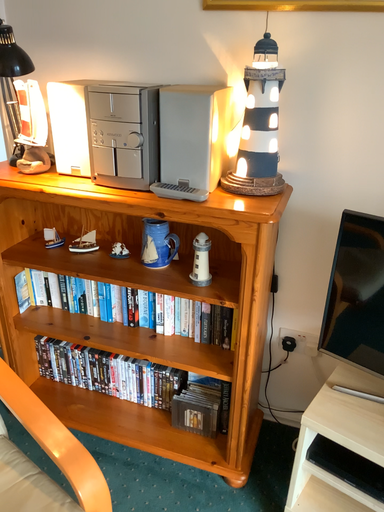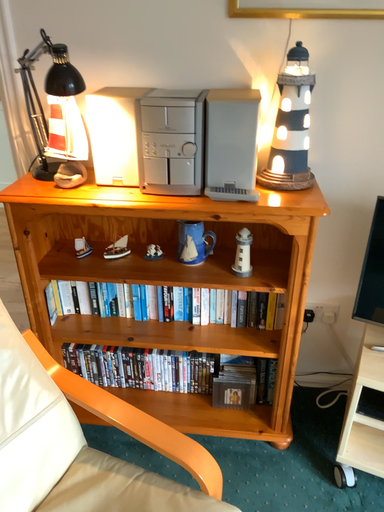
Question: How did the camera likely rotate when shooting the video?

Choices:
 (A) rotated right
 (B) rotated left

Answer: (A)